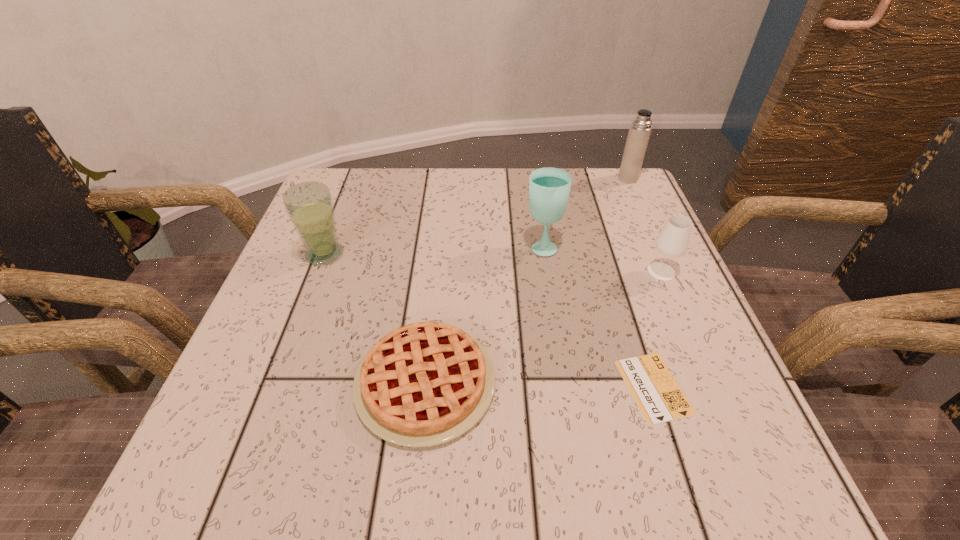
You are a GUI agent. You are given a task and a screenshot of the screen. Output one action in this format:
    pyautogui.click(x=<x>, y=<y>)
    Task: Click on the identity card present at the right edge
    The width and height of the screenshot is (960, 540).
    Given the screenshot: What is the action you would take?
    pyautogui.click(x=656, y=393)

Image resolution: width=960 pixels, height=540 pixels. Find the location of `object that is at the far right corner`. object that is at the far right corner is located at coordinates (639, 132).

Locate an element on the screen. The width and height of the screenshot is (960, 540). vacant area at the far edge is located at coordinates (464, 171).

Where is `free space at the near edge`? free space at the near edge is located at coordinates (491, 448).

In the image, there is a desktop. At what (x,y) coordinates should I click in order to perform the action: click on vacant space at the right edge. Please return your answer as a coordinate pair (x, y). The width and height of the screenshot is (960, 540). Looking at the image, I should click on (675, 351).

In the image, there is a desktop. Identify the location of blank space at the near left corner. (212, 475).

Image resolution: width=960 pixels, height=540 pixels. I want to click on vacant point at the near right corner, so click(691, 438).

Where is `vacant region between the leftmost object and the pie`? This screenshot has height=540, width=960. vacant region between the leftmost object and the pie is located at coordinates (375, 319).

Identify the location of blank region between the rightmost glass and the third object from left to right. (602, 259).

The height and width of the screenshot is (540, 960). I want to click on unoccupied area between the identity card and the second shortest object, so click(x=540, y=385).